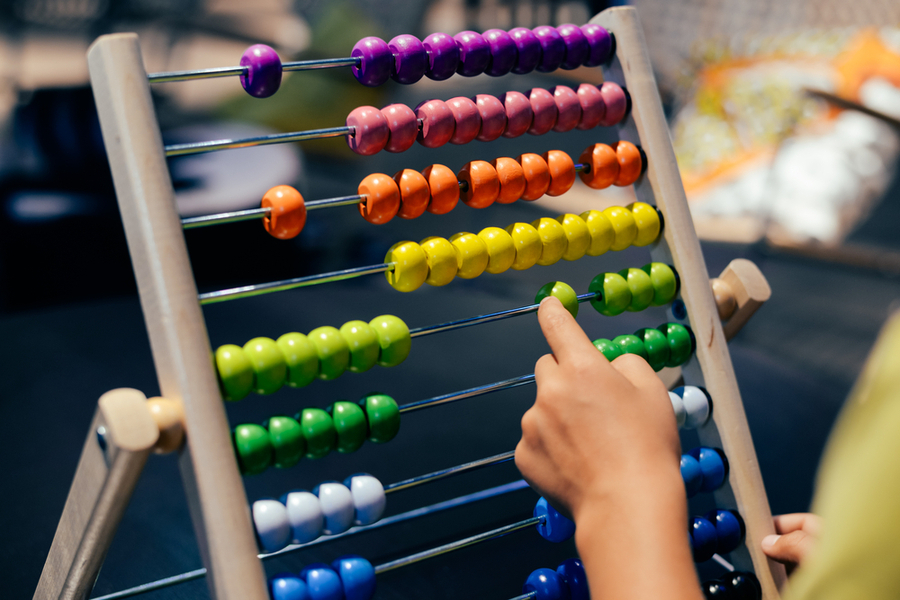
Find the location of `pink bead`. pink bead is located at coordinates (365, 139), (406, 126), (432, 130), (464, 124), (493, 115), (518, 114), (538, 115), (569, 109), (594, 109), (618, 106).